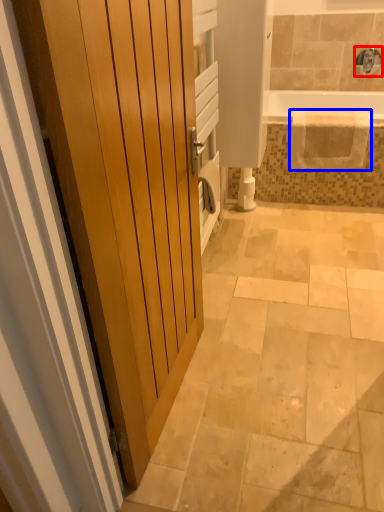
Question: Which object appears closest to the camera in this image, faucet (highlighted by a red box) or blanket (highlighted by a blue box)?

Choices:
 (A) faucet
 (B) blanket

Answer: (B)